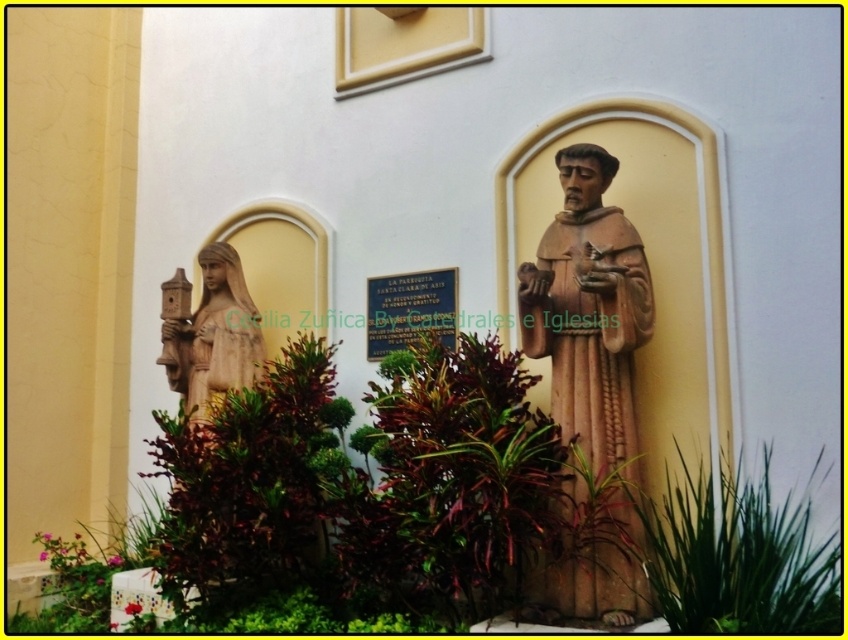
You are standing in front of the building and want to take a photo of the matte brown statue at center with your phone. Your phone can focus clearly on objects within 2.5 meters. Will the statue be in focus?

The matte brown statue at center is 2.63 meters away from the camera, which is beyond the 2.5 meters focusing range of your phone. Therefore, the statue will not be in focus.

You are standing in front of the building and want to water the green leafy plant at center. Your watering can has a maximum reach of 2 meters. Can you reach the plant without moving closer?

The green leafy plant at center is 2.33 meters away from you, which is beyond the watering can reach of 2 meters. You need to move closer to reach it.

You are standing in front of the building and want to take a photo of both the matte brown statue at center and the wooden statue at left. Which statue should you position closer to the camera to ensure both are fully visible in the frame?

You should position the matte brown statue at center closer to the camera because it is in front of the wooden statue at left, so adjusting its position will help both appear clearly in the photo.